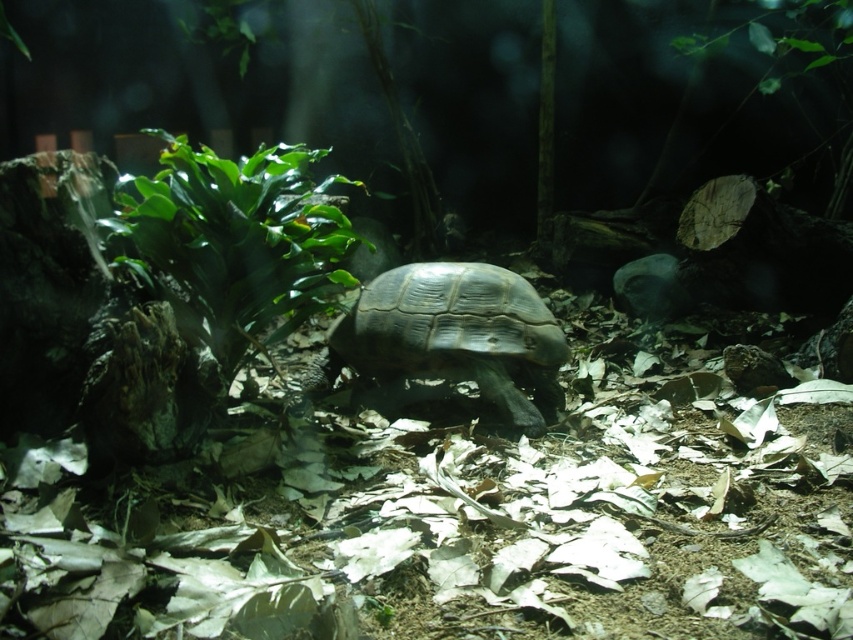
Question: Is green glossy leafy plant at center-left wider than shiny brown tortoise at center?

Choices:
 (A) no
 (B) yes

Answer: (A)

Question: Among these points, which one is farthest from the camera?

Choices:
 (A) (164, 161)
 (B) (473, 307)

Answer: (B)

Question: Considering the relative positions of green glossy leafy plant at center-left and shiny brown tortoise at center in the image provided, where is green glossy leafy plant at center-left located with respect to shiny brown tortoise at center?

Choices:
 (A) left
 (B) right

Answer: (A)

Question: Is green glossy leafy plant at center-left above shiny brown tortoise at center?

Choices:
 (A) yes
 (B) no

Answer: (A)